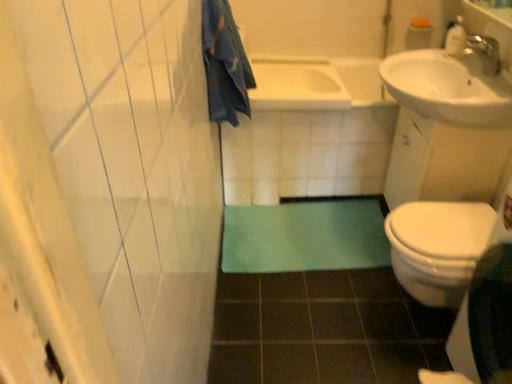
Question: Is white glossy bathtub at center, placed as the 2th bath when sorted from left to right, oriented away from blue cotton towel at upper left?

Choices:
 (A) no
 (B) yes

Answer: (A)

Question: Is white glossy bathtub at center, placed as the 2th bath when sorted from left to right, surrounding blue cotton towel at upper left?

Choices:
 (A) yes
 (B) no

Answer: (B)

Question: Considering the relative positions of white glossy bathtub at center, which is counted as the 1th bath, starting from the right, and blue cotton towel at upper left in the image provided, is white glossy bathtub at center, which is counted as the 1th bath, starting from the right, to the right of blue cotton towel at upper left from the viewer's perspective?

Choices:
 (A) yes
 (B) no

Answer: (A)

Question: From a real-world perspective, is white glossy bathtub at center, placed as the 2th bath when sorted from left to right, over blue cotton towel at upper left?

Choices:
 (A) no
 (B) yes

Answer: (A)

Question: Is white glossy bathtub at center, placed as the 2th bath when sorted from left to right, to the left of blue cotton towel at upper left from the viewer's perspective?

Choices:
 (A) yes
 (B) no

Answer: (B)

Question: From a real-world perspective, is white glossy bathtub at center, placed as the 2th bath when sorted from left to right, physically below blue cotton towel at upper left?

Choices:
 (A) no
 (B) yes

Answer: (B)

Question: Is white glossy sink at upper right looking in the opposite direction of blue cotton towel at upper left?

Choices:
 (A) no
 (B) yes

Answer: (A)

Question: Is white glossy sink at upper right aimed at blue cotton towel at upper left?

Choices:
 (A) no
 (B) yes

Answer: (B)

Question: Is white glossy sink at upper right in contact with blue cotton towel at upper left?

Choices:
 (A) no
 (B) yes

Answer: (A)

Question: From the image's perspective, is white glossy sink at upper right on blue cotton towel at upper left?

Choices:
 (A) no
 (B) yes

Answer: (A)

Question: Is white glossy sink at upper right shorter than blue cotton towel at upper left?

Choices:
 (A) yes
 (B) no

Answer: (A)

Question: Is white glossy sink at upper right not near blue cotton towel at upper left?

Choices:
 (A) yes
 (B) no

Answer: (B)

Question: From a real-world perspective, is white glossy bathtub at center, placed as the 2th bath when sorted from left to right, under white plastic soap dispenser at upper right?

Choices:
 (A) no
 (B) yes

Answer: (B)